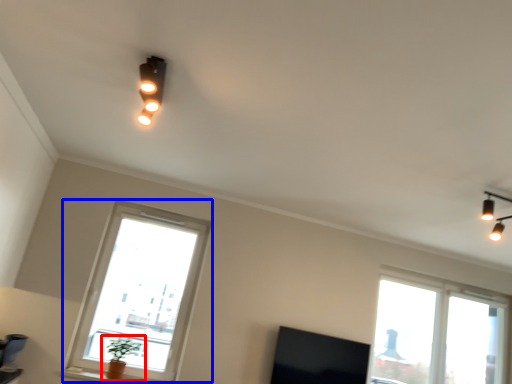
Question: Among these objects, which one is nearest to the camera, houseplant (highlighted by a red box) or window (highlighted by a blue box)?

Choices:
 (A) houseplant
 (B) window

Answer: (A)